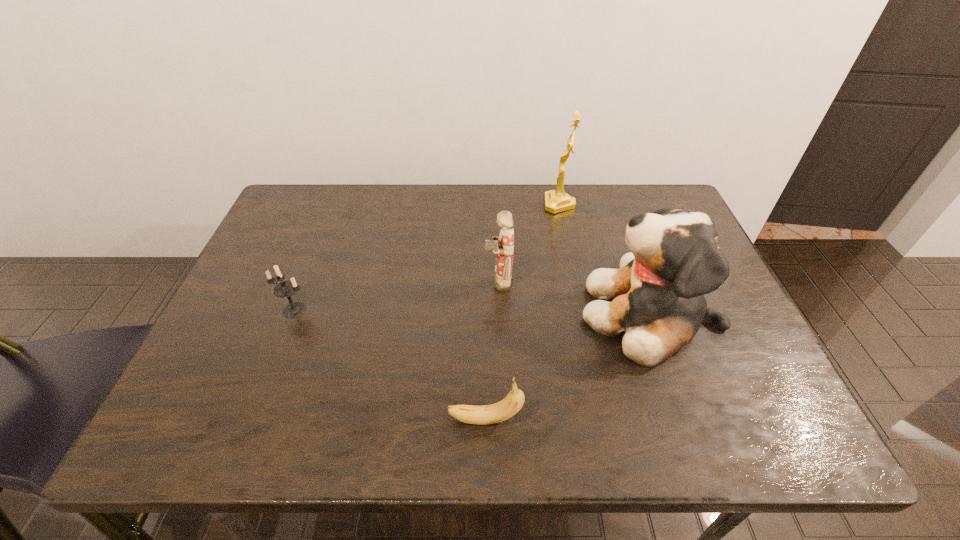
Where is `vacant position located at the face of the puppy`? The width and height of the screenshot is (960, 540). vacant position located at the face of the puppy is located at coordinates (443, 314).

Find the location of a particular element. vacant position located on the front-facing side of the figurine is located at coordinates point(364,281).

You are a GUI agent. You are given a task and a screenshot of the screen. Output one action in this format:
    pyautogui.click(x=<x>, y=<y>)
    Task: Click on the free space located on the front-facing side of the figurine
    Image resolution: width=960 pixels, height=540 pixels.
    Given the screenshot: What is the action you would take?
    pyautogui.click(x=395, y=281)

Where is `blank area located on the front-facing side of the figurine`? This screenshot has height=540, width=960. blank area located on the front-facing side of the figurine is located at coordinates (375, 281).

At what (x,y) coordinates should I click in order to perform the action: click on free space located 0.170m on the right of the candle holder. Please return your answer as a coordinate pair (x, y). This screenshot has height=540, width=960. Looking at the image, I should click on (383, 310).

I want to click on free spot located 0.360m at the start of the peel on the banana, so click(x=264, y=420).

Where is `free region located 0.230m at the start of the peel on the banana`? free region located 0.230m at the start of the peel on the banana is located at coordinates (330, 420).

In order to click on free space located at the start of the peel on the banana in this screenshot , I will do `click(269, 420)`.

This screenshot has width=960, height=540. What are the coordinates of `object that is positioned at the far edge` in the screenshot? It's located at (556, 201).

Locate an element on the screen. The width and height of the screenshot is (960, 540). object that is at the near edge is located at coordinates click(487, 414).